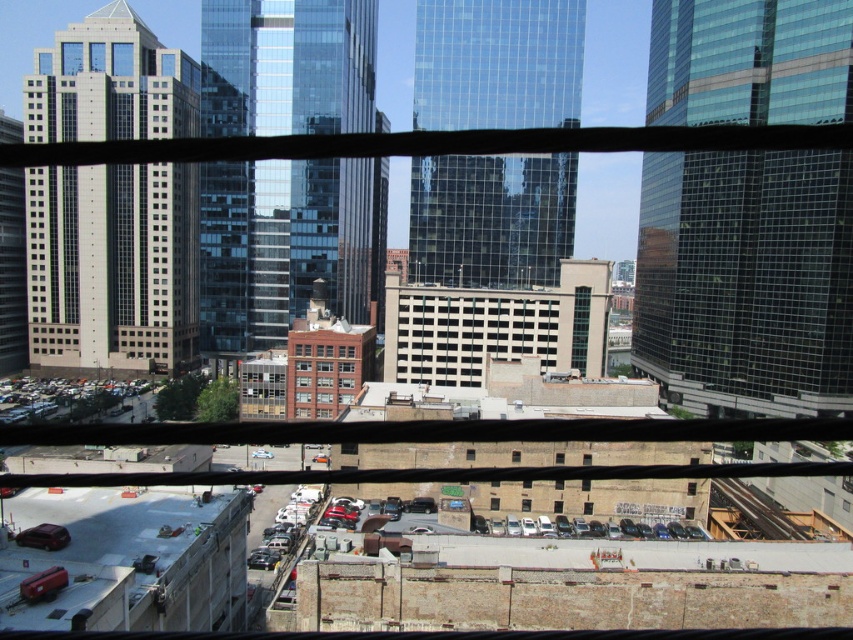
You are a delivery person trying to load a package onto the shiny silver car at lower center and the shiny metallic car at lower center. Which car has enough vertical space to accommodate a large box that requires more height?

The shiny silver car at lower center has a greater height compared to the shiny metallic car at lower center, so it can accommodate the large box requiring more height.

You are standing inside a building looking out through a window with bars. You see a brown brick building at center and a metallic silver car at lower center. Which object is closer to you?

The metallic silver car at lower center is behind the brown brick building at center, so the brown brick building at center is closer to you.